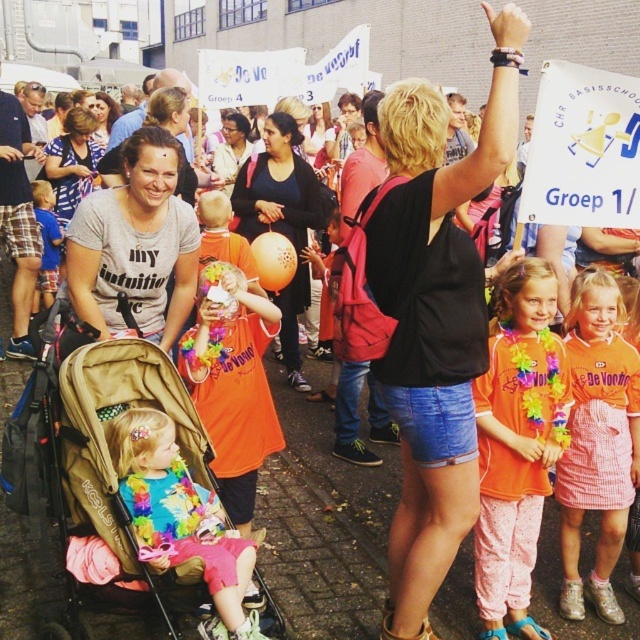
Question: Does orange fabric lei at center have a smaller size compared to pink checkered skirt at center?

Choices:
 (A) yes
 (B) no

Answer: (A)

Question: Which is farther from the matte gray t-shirt at center?

Choices:
 (A) matte black sweater at center
 (B) matte black shirt at upper left
 (C) orange fabric lei at center

Answer: (B)

Question: Which object is positioned farthest from the matte pink pants at lower left?

Choices:
 (A) black fabric backpack at upper center
 (B) pink checkered skirt at center

Answer: (B)

Question: Which of the following is the farthest from the observer?

Choices:
 (A) (42, 417)
 (B) (573, 586)

Answer: (B)

Question: Is orange fabric lei at center closer to the viewer compared to pink checkered skirt at center?

Choices:
 (A) yes
 (B) no

Answer: (A)

Question: Is black fabric backpack at upper center wider than matte black shirt at upper left?

Choices:
 (A) no
 (B) yes

Answer: (A)